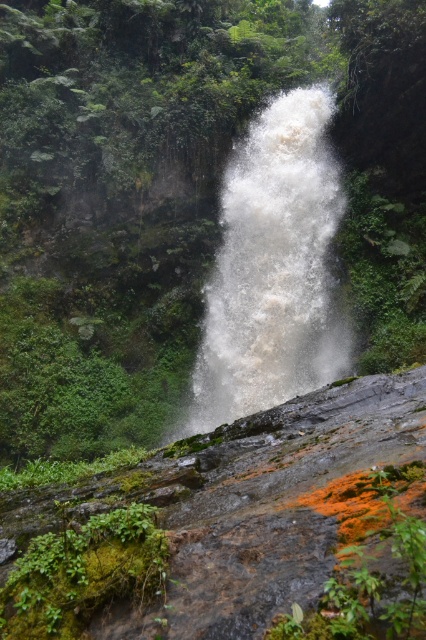
Question: Among these points, which one is nearest to the camera?

Choices:
 (A) tap(273, 388)
 (B) tap(71, 620)

Answer: (B)

Question: Observing the image, what is the correct spatial positioning of white frothy water at center in reference to green mossy rock at lower left?

Choices:
 (A) left
 (B) right

Answer: (B)

Question: Does white frothy water at center have a larger size compared to green mossy rock at lower left?

Choices:
 (A) no
 (B) yes

Answer: (A)

Question: Which of the following is the closest to the observer?

Choices:
 (A) (290, 228)
 (B) (46, 620)

Answer: (B)

Question: Does white frothy water at center appear over green mossy rock at lower left?

Choices:
 (A) yes
 (B) no

Answer: (A)

Question: Which object is farther from the camera taking this photo?

Choices:
 (A) white frothy water at center
 (B) green mossy rock at lower left

Answer: (A)